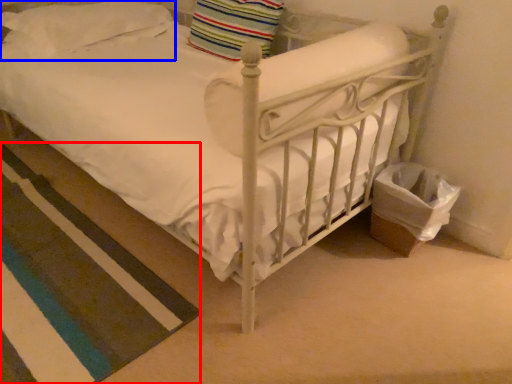
Question: Which of the following is the farthest to the observer, strip (highlighted by a red box) or pillow (highlighted by a blue box)?

Choices:
 (A) strip
 (B) pillow

Answer: (B)